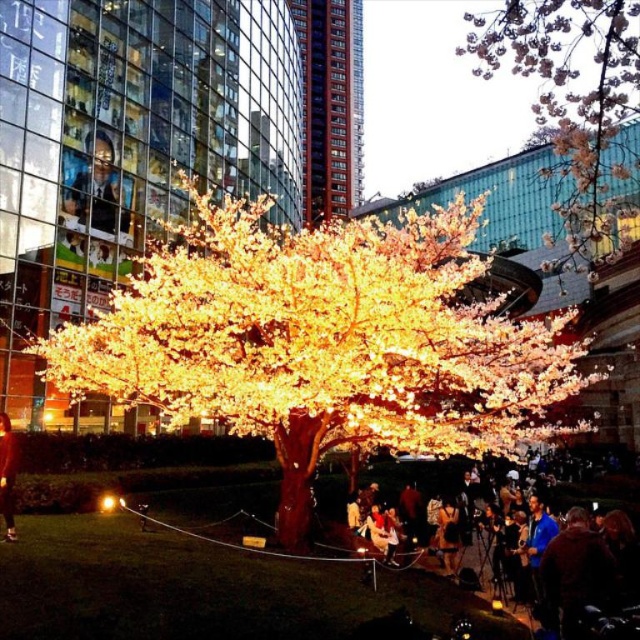
Question: Among these objects, which one is nearest to the camera?

Choices:
 (A) matte black jacket at lower right
 (B) matte black jacket at lower left

Answer: (A)

Question: Which object appears farthest from the camera in this image?

Choices:
 (A) matte black jacket at lower right
 (B) illuminated plastic tree at center

Answer: (B)

Question: Can you confirm if illuminated plastic tree at center is smaller than pink blossoms at upper right?

Choices:
 (A) yes
 (B) no

Answer: (A)

Question: Does pink blossoms at upper right appear on the right side of matte black jacket at lower right?

Choices:
 (A) no
 (B) yes

Answer: (B)

Question: Which point is farther to the camera?

Choices:
 (A) pink blossoms at upper right
 (B) matte black jacket at lower right

Answer: (A)

Question: Considering the relative positions of illuminated plastic tree at center and matte black jacket at lower right in the image provided, where is illuminated plastic tree at center located with respect to matte black jacket at lower right?

Choices:
 (A) above
 (B) below

Answer: (A)